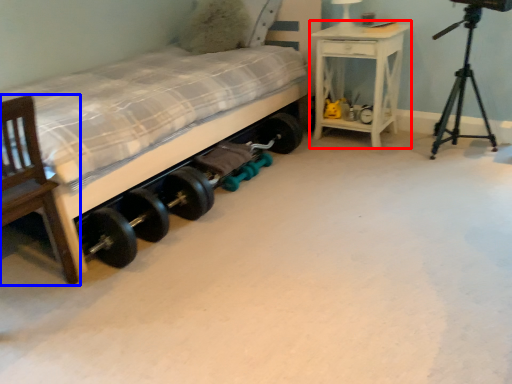
Question: Which object is further to the camera taking this photo, nightstand (highlighted by a red box) or chair (highlighted by a blue box)?

Choices:
 (A) nightstand
 (B) chair

Answer: (A)